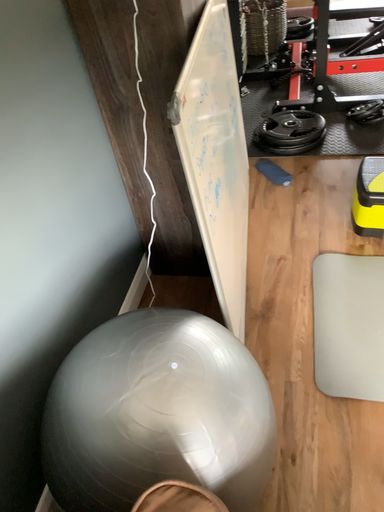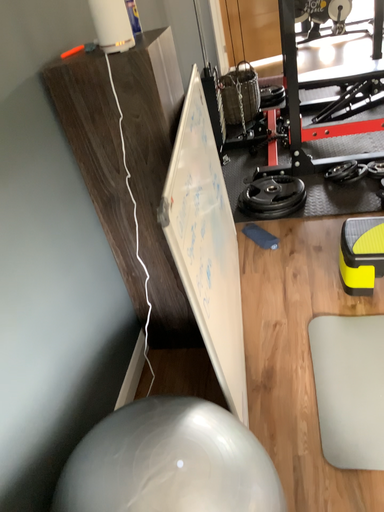
Question: How did the camera likely rotate when shooting the video?

Choices:
 (A) rotated downward
 (B) rotated upward

Answer: (B)